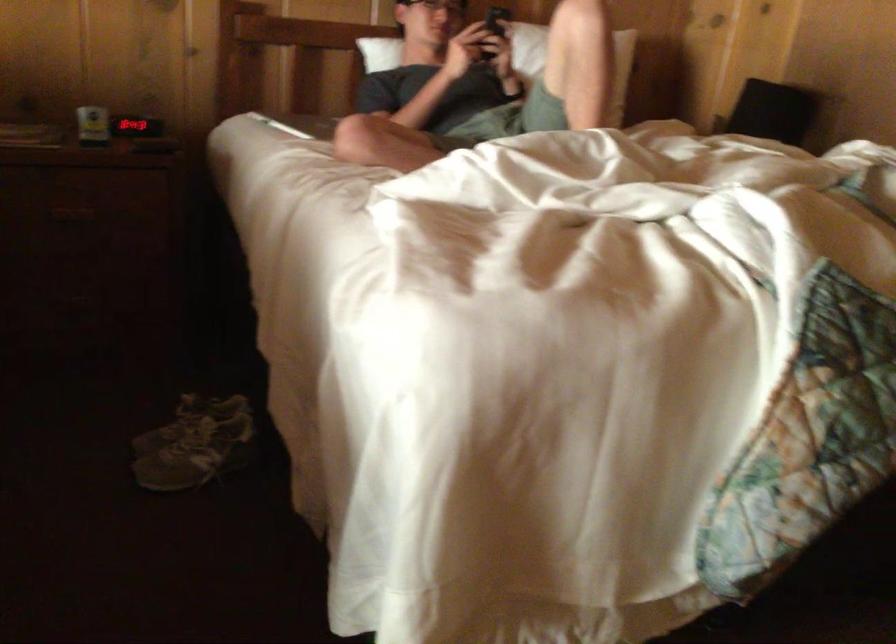
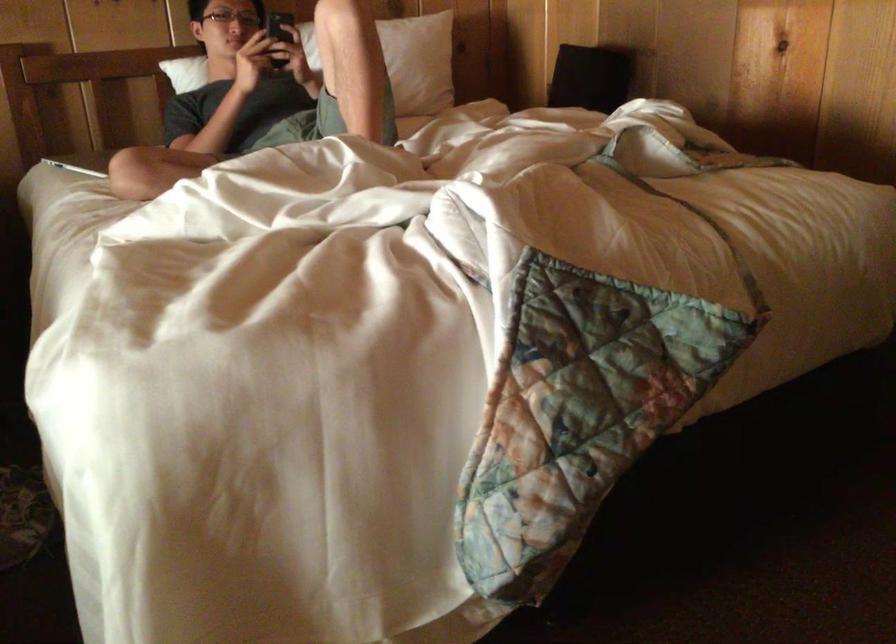
Question: Based on the continuous images, in which direction is the camera rotating? Reply with the corresponding letter.

Choices:
 (A) Left
 (B) Right
 (C) Up
 (D) Down

Answer: (B)